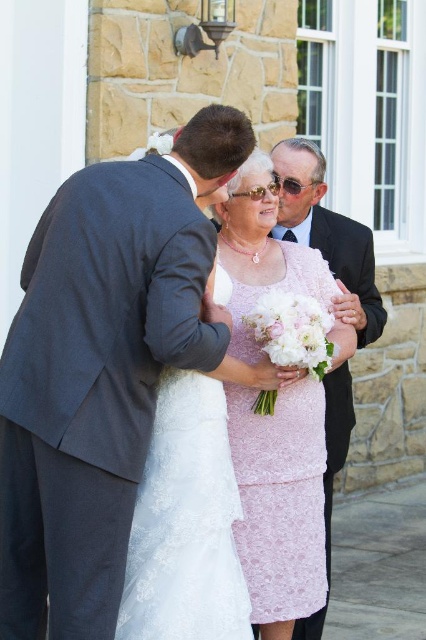
Between pink lace dress at center and matte black suit at upper center, which one has more height?

pink lace dress at center

Can you confirm if pink lace dress at center is bigger than matte black suit at upper center?

Incorrect, pink lace dress at center is not larger than matte black suit at upper center.

Find the location of a particular element. pink lace dress at center is located at coordinates (273, 413).